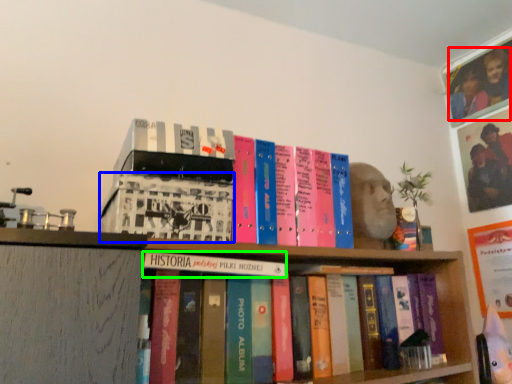
Question: Which object is the farthest from couple (highlighted by a red box)? Choose among these: book (highlighted by a blue box) or book (highlighted by a green box).

Choices:
 (A) book
 (B) book

Answer: (A)